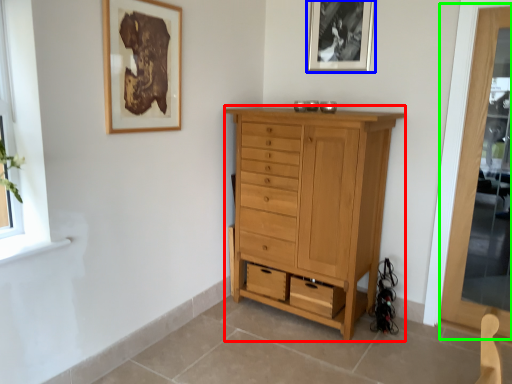
Question: Based on their relative distances, which object is farther from chest of drawers (highlighted by a red box)? Choose from picture frame (highlighted by a blue box) and screen door (highlighted by a green box).

Choices:
 (A) picture frame
 (B) screen door

Answer: (A)